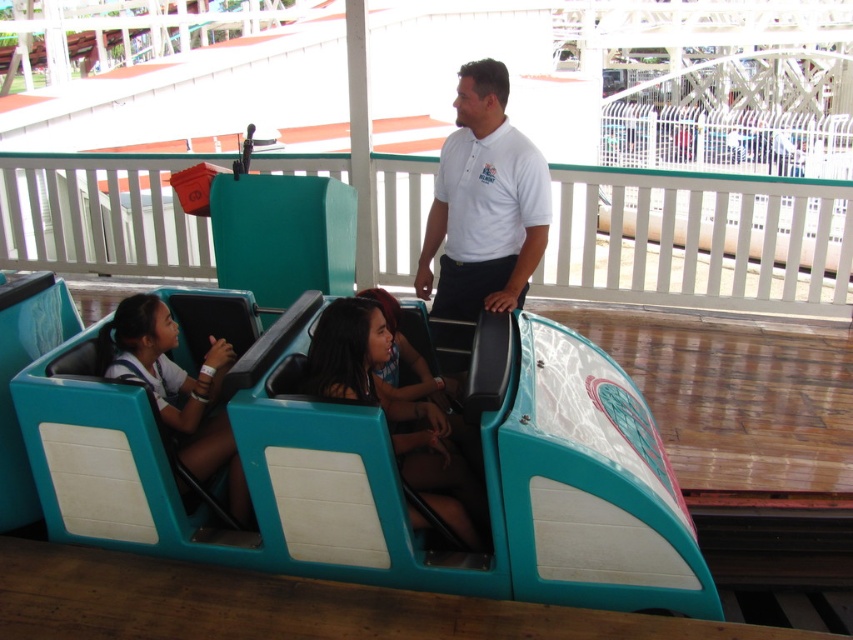
Does white cotton shirt at center have a lesser width compared to matte teal seat at center?

Incorrect, white cotton shirt at center's width is not less than matte teal seat at center's.

The width and height of the screenshot is (853, 640). I want to click on white cotton shirt at center, so click(x=485, y=204).

Where is `white cotton shirt at center`? Image resolution: width=853 pixels, height=640 pixels. white cotton shirt at center is located at coordinates click(485, 204).

Can you confirm if white cotton shirt at center is positioned to the left of white matte shirt at center?

No, white cotton shirt at center is not to the left of white matte shirt at center.

Is white cotton shirt at center positioned in front of white matte shirt at center?

No, it is not.

Is point (463, 179) more distant than point (140, 292)?

Yes, it is behind point (140, 292).

Locate an element on the screen. The height and width of the screenshot is (640, 853). white cotton shirt at center is located at coordinates (485, 204).

Is matte teal seat at center closer to camera compared to white matte shirt at center?

Yes, matte teal seat at center is closer to the viewer.

Is matte teal seat at center further to camera compared to white matte shirt at center?

That is False.

Is point (445, 464) positioned in front of point (218, 435)?

Yes, point (445, 464) is closer to viewer.

In order to click on matte teal seat at center in this screenshot , I will do 397,413.